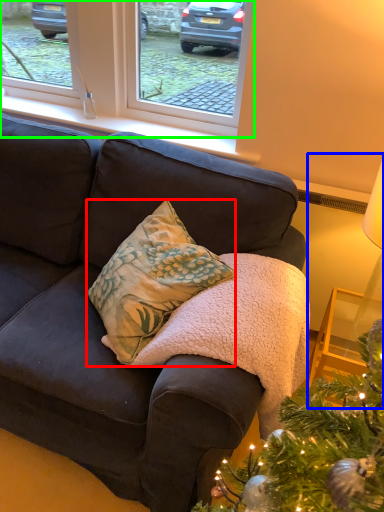
Question: Estimate the real-world distances between objects in this image. Which object is farther from pillow (highlighted by a red box), table lamp (highlighted by a blue box) or window (highlighted by a green box)?

Choices:
 (A) table lamp
 (B) window

Answer: (B)